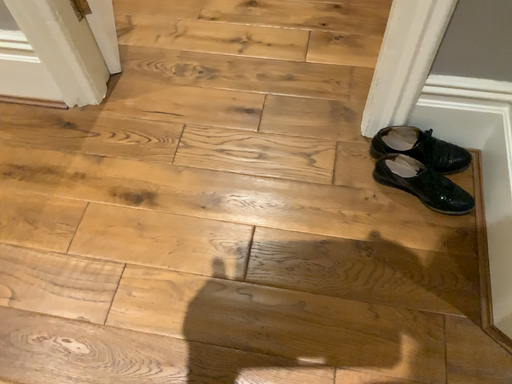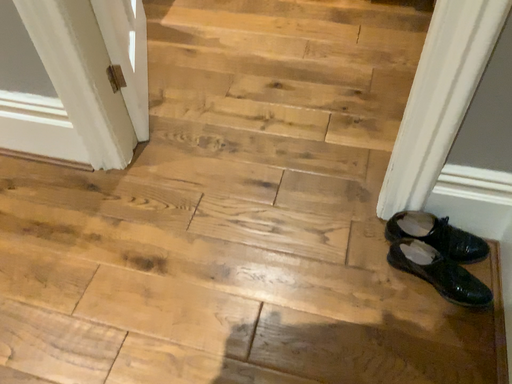
Question: Which way did the camera rotate in the video?

Choices:
 (A) rotated upward
 (B) rotated downward

Answer: (A)